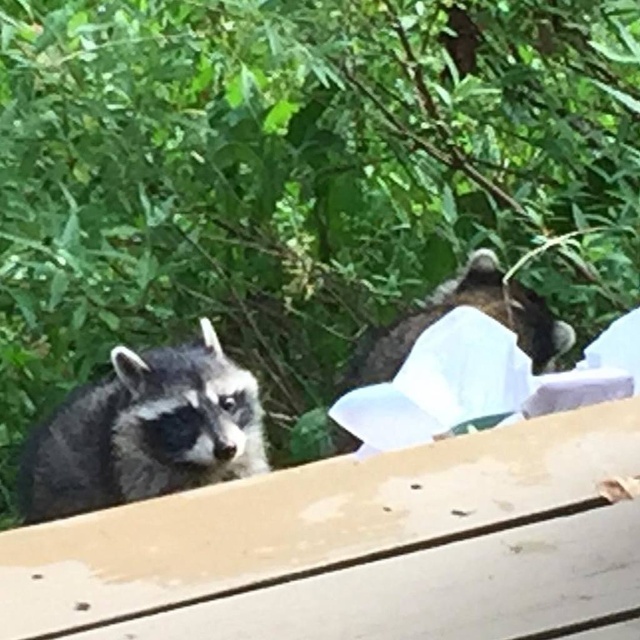
Question: Does gray fur raccoon at left lie in front of dark gray fur raccoon at center?

Choices:
 (A) yes
 (B) no

Answer: (A)

Question: Which of the following is the farthest from the observer?

Choices:
 (A) (365, 364)
 (B) (204, 371)

Answer: (A)

Question: Is the position of gray fur raccoon at left less distant than that of dark gray fur raccoon at center?

Choices:
 (A) yes
 (B) no

Answer: (A)

Question: Can you confirm if gray fur raccoon at left is positioned below dark gray fur raccoon at center?

Choices:
 (A) no
 (B) yes

Answer: (B)

Question: Which point is closer to the camera taking this photo?

Choices:
 (A) (481, 292)
 (B) (138, 456)

Answer: (B)